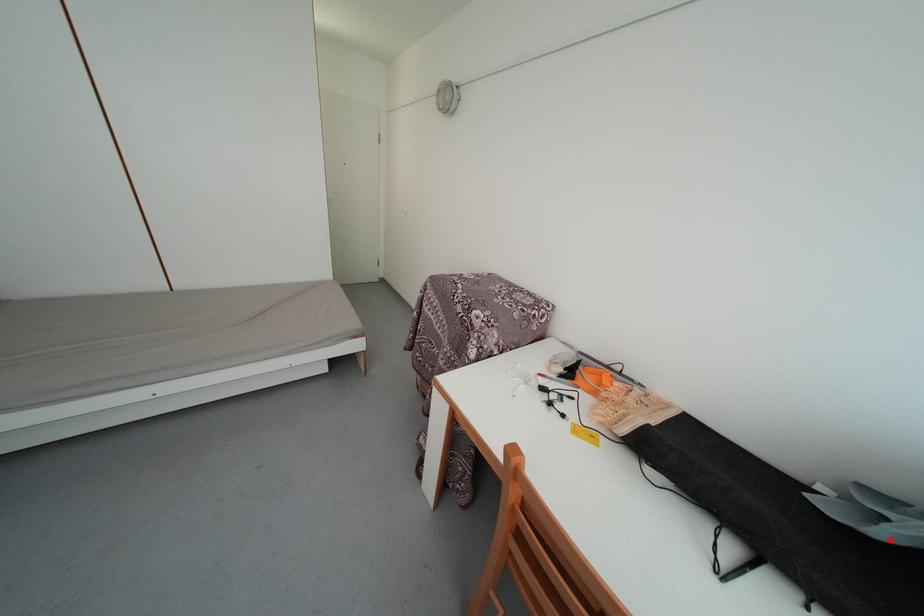
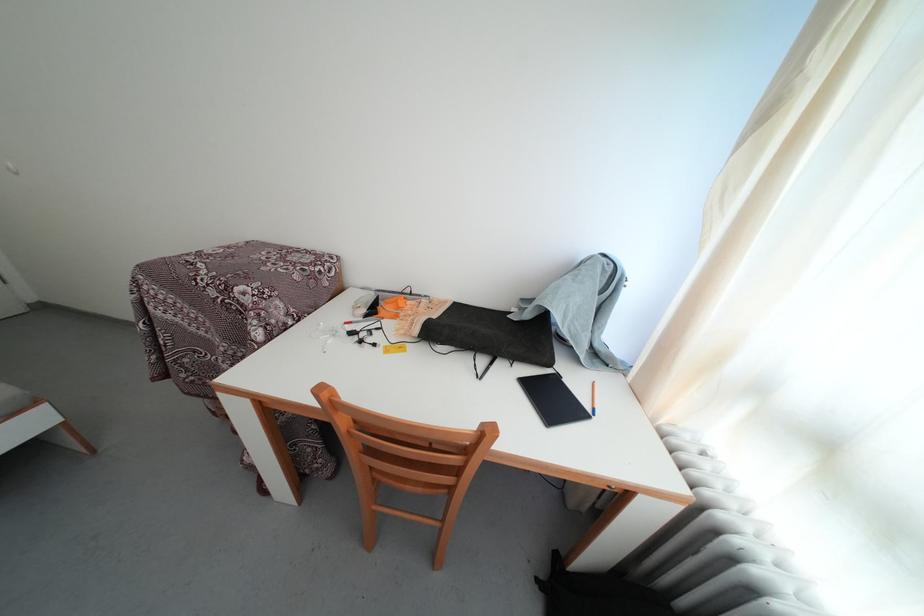
The point at the highlighted location is marked in the first image. Where is the corresponding point in the second image?

(533, 322)